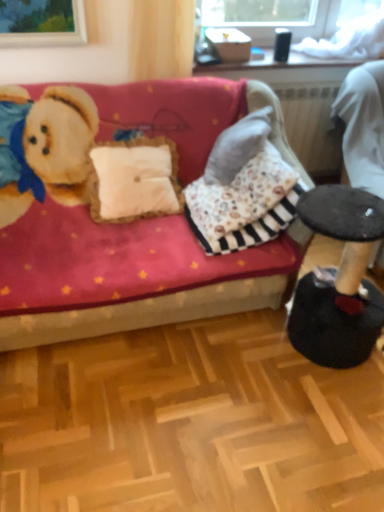
Question: Considering the relative sizes of dark brown leather swivel chair at right and velvet red couch at center in the image provided, is dark brown leather swivel chair at right bigger than velvet red couch at center?

Choices:
 (A) yes
 (B) no

Answer: (B)

Question: Can you confirm if dark brown leather swivel chair at right is smaller than velvet red couch at center?

Choices:
 (A) yes
 (B) no

Answer: (A)

Question: Does dark brown leather swivel chair at right appear on the right side of velvet red couch at center?

Choices:
 (A) yes
 (B) no

Answer: (A)

Question: Does dark brown leather swivel chair at right touch velvet red couch at center?

Choices:
 (A) no
 (B) yes

Answer: (A)

Question: Considering the relative positions of dark brown leather swivel chair at right and velvet red couch at center in the image provided, is dark brown leather swivel chair at right in front of velvet red couch at center?

Choices:
 (A) no
 (B) yes

Answer: (A)

Question: Can you confirm if dark brown leather swivel chair at right is thinner than velvet red couch at center?

Choices:
 (A) yes
 (B) no

Answer: (A)

Question: Can we say velvet red couch at center lies outside dark brown leather swivel chair at right?

Choices:
 (A) no
 (B) yes

Answer: (B)

Question: Is velvet red couch at center wider than dark brown leather swivel chair at right?

Choices:
 (A) no
 (B) yes

Answer: (B)

Question: Considering the relative positions of velvet red couch at center and dark brown leather swivel chair at right in the image provided, is velvet red couch at center in front of dark brown leather swivel chair at right?

Choices:
 (A) no
 (B) yes

Answer: (B)

Question: Is velvet red couch at center to the left of dark brown leather swivel chair at right from the viewer's perspective?

Choices:
 (A) no
 (B) yes

Answer: (B)

Question: From a real-world perspective, is velvet red couch at center under dark brown leather swivel chair at right?

Choices:
 (A) yes
 (B) no

Answer: (A)

Question: Is velvet red couch at center taller than dark brown leather swivel chair at right?

Choices:
 (A) no
 (B) yes

Answer: (A)

Question: Would you say dark brown leather swivel chair at right is inside or outside velvet red couch at center?

Choices:
 (A) inside
 (B) outside

Answer: (B)